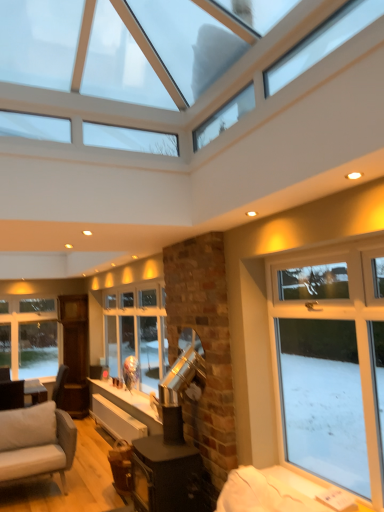
Image resolution: width=384 pixels, height=512 pixels. In order to click on white glass window at lower left, which is the second window in top-to-bottom order in this screenshot , I will do `click(29, 337)`.

What is the approximate width of white glass window at lower left, the 1th window viewed from the back?

4.07 inches.

Describe the element at coordinates (29, 337) in the screenshot. I see `white glass window at lower left, the second window viewed from the front` at that location.

In order to click on clear glass window at upper center, which is the second window from bottom to top in this screenshot , I will do `click(196, 100)`.

Measure the distance between clear glass window at upper center, which is the second window from bottom to top, and camera.

clear glass window at upper center, which is the second window from bottom to top, is 1.75 meters from camera.

What do you see at coordinates (196, 100) in the screenshot? The image size is (384, 512). I see `clear glass window at upper center, positioned as the 1th window in top-to-bottom order` at bounding box center [196, 100].

How much space does clear glass window at upper center, which appears as the 1th window when viewed from the front, occupy horizontally?

clear glass window at upper center, which appears as the 1th window when viewed from the front, is 1.64 meters wide.

Where is `white glass window at lower left, the 1th window viewed from the back`? white glass window at lower left, the 1th window viewed from the back is located at coordinates (29, 337).

Is clear glass window at upper center, which is the second window from bottom to top, at the left side of white glass window at lower left, the 1th window viewed from the back?

Incorrect, clear glass window at upper center, which is the second window from bottom to top, is not on the left side of white glass window at lower left, the 1th window viewed from the back.

Is clear glass window at upper center, the 2th window from the back, in front of or behind white glass window at lower left, the second window viewed from the front, in the image?

Clearly, clear glass window at upper center, the 2th window from the back, is in front of white glass window at lower left, the second window viewed from the front.

Is point (312, 19) positioned before point (13, 322)?

Yes, it is in front of point (13, 322).

From the image's perspective, is clear glass window at upper center, which appears as the 1th window when viewed from the front, on top of white glass window at lower left, which is the second window in top-to-bottom order?

Indeed, from the image's perspective, clear glass window at upper center, which appears as the 1th window when viewed from the front, is shown above white glass window at lower left, which is the second window in top-to-bottom order.

From a real-world perspective, is clear glass window at upper center, the 2th window from the back, below white glass window at lower left, which is the second window in top-to-bottom order?

No, from a real-world perspective, clear glass window at upper center, the 2th window from the back, is not beneath white glass window at lower left, which is the second window in top-to-bottom order.

Which of these two, clear glass window at upper center, the 2th window from the back, or white glass window at lower left, which is the second window in top-to-bottom order, is wider?

Wider between the two is clear glass window at upper center, the 2th window from the back.

Considering the sizes of clear glass window at upper center, the 2th window from the back, and white glass window at lower left, the second window viewed from the front, in the image, is clear glass window at upper center, the 2th window from the back, taller or shorter than white glass window at lower left, the second window viewed from the front,?

In the image, clear glass window at upper center, the 2th window from the back, appears to be shorter than white glass window at lower left, the second window viewed from the front.

Is clear glass window at upper center, positioned as the 1th window in top-to-bottom order, bigger or smaller than white glass window at lower left, the 1th window positioned from the bottom?

Considering their sizes, clear glass window at upper center, positioned as the 1th window in top-to-bottom order, takes up more space than white glass window at lower left, the 1th window positioned from the bottom.

Could white glass window at lower left, which is the second window in top-to-bottom order, be considered to be inside clear glass window at upper center, the 2th window from the back?

No, white glass window at lower left, which is the second window in top-to-bottom order, is not surrounded by clear glass window at upper center, the 2th window from the back.

Is clear glass window at upper center, which appears as the 1th window when viewed from the front, oriented towards white glass window at lower left, the second window viewed from the front?

No.

What's the angular difference between clear glass window at upper center, the 2th window from the back, and white glass window at lower left, the 1th window viewed from the back,'s facing directions?

clear glass window at upper center, the 2th window from the back, and white glass window at lower left, the 1th window viewed from the back, are facing 89.7 degrees away from each other.

Find the location of `window located underneath the clear glass window at upper center, the 2th window from the back (from a real-world perspective)`. window located underneath the clear glass window at upper center, the 2th window from the back (from a real-world perspective) is located at coordinates (29, 337).

Would you say white glass window at lower left, the 1th window viewed from the back, is to the left or to the right of clear glass window at upper center, which appears as the 1th window when viewed from the front, in the picture?

From the image, it's evident that white glass window at lower left, the 1th window viewed from the back, is to the left of clear glass window at upper center, which appears as the 1th window when viewed from the front.

Who is more distant, white glass window at lower left, which is the second window in top-to-bottom order, or clear glass window at upper center, the 2th window from the back?

white glass window at lower left, which is the second window in top-to-bottom order, is more distant.

Which point is more forward, (x=16, y=326) or (x=10, y=86)?

Positioned in front is point (x=10, y=86).

From the image's perspective, is white glass window at lower left, which is the second window in top-to-bottom order, located beneath clear glass window at upper center, the 2th window from the back?

Yes.

From a real-world perspective, relative to clear glass window at upper center, which appears as the 1th window when viewed from the front, is white glass window at lower left, the second window viewed from the front, vertically above or below?

Clearly, from a real-world perspective, white glass window at lower left, the second window viewed from the front, is below clear glass window at upper center, which appears as the 1th window when viewed from the front.

From the picture: Between white glass window at lower left, which is the second window in top-to-bottom order, and clear glass window at upper center, positioned as the 1th window in top-to-bottom order, which one has larger width?

With larger width is clear glass window at upper center, positioned as the 1th window in top-to-bottom order.

Considering the relative sizes of white glass window at lower left, which is the second window in top-to-bottom order, and clear glass window at upper center, the 2th window from the back, in the image provided, is white glass window at lower left, which is the second window in top-to-bottom order, taller than clear glass window at upper center, the 2th window from the back,?

Yes.

Who is smaller, white glass window at lower left, the 1th window positioned from the bottom, or clear glass window at upper center, which is the second window from bottom to top?

Smaller between the two is white glass window at lower left, the 1th window positioned from the bottom.

Is white glass window at lower left, the 1th window positioned from the bottom, situated inside clear glass window at upper center, the 2th window from the back, or outside?

white glass window at lower left, the 1th window positioned from the bottom, is not enclosed by clear glass window at upper center, the 2th window from the back.

Are white glass window at lower left, the 1th window viewed from the back, and clear glass window at upper center, positioned as the 1th window in top-to-bottom order, beside each other?

There is a gap between white glass window at lower left, the 1th window viewed from the back, and clear glass window at upper center, positioned as the 1th window in top-to-bottom order.

Is white glass window at lower left, the 1th window viewed from the back, looking in the opposite direction of clear glass window at upper center, positioned as the 1th window in top-to-bottom order?

No, white glass window at lower left, the 1th window viewed from the back, is not facing away from clear glass window at upper center, positioned as the 1th window in top-to-bottom order.

How many degrees apart are the facing directions of white glass window at lower left, which is the second window in top-to-bottom order, and clear glass window at upper center, the 2th window from the back?

They differ by 89.7 degrees in their facing directions.

The image size is (384, 512). What are the coordinates of `window in front of the white glass window at lower left, the 1th window positioned from the bottom` in the screenshot? It's located at (196, 100).

I want to click on window that is behind the clear glass window at upper center, which is the second window from bottom to top, so click(29, 337).

I want to click on window above the white glass window at lower left, the 1th window viewed from the back (from a real-world perspective), so click(196, 100).